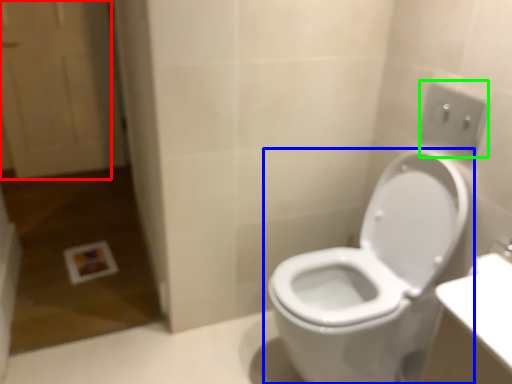
Question: Which object is positioned farthest from screen door (highlighted by a red box)? Select from toilet (highlighted by a blue box) and electric outlet (highlighted by a green box).

Choices:
 (A) toilet
 (B) electric outlet

Answer: (B)